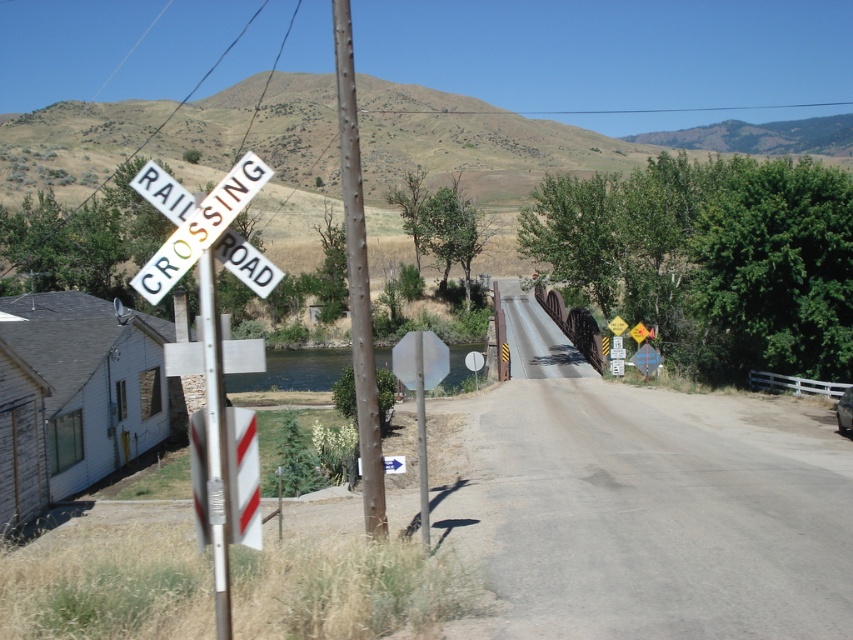
You are a delivery driver approaching the railroad crossing and need to park your truck between the rusty metal pole at center and the metallic pole at left. Your truck is 5 meters long. Can you safely park your truck in that space without overlapping either pole?

The rusty metal pole at center is 5.61 meters from the metallic pole at left. Since your truck is 5 meters long, there is sufficient space between the two poles to park safely without overlapping either pole.

Consider the image. You are driving a car and see the white plastic railroad crossing sign at left and the metallic pole at left. Which one is positioned more to the left side of the road?

The white plastic railroad crossing sign at left is positioned more to the left side of the road than the metallic pole at left.

You are a painter who needs to paint both the rusty metal pole at center and the metallic pole at left. Which pole will require more paint because it is taller?

The rusty metal pole at center requires more paint because it is much taller than the metallic pole at left.